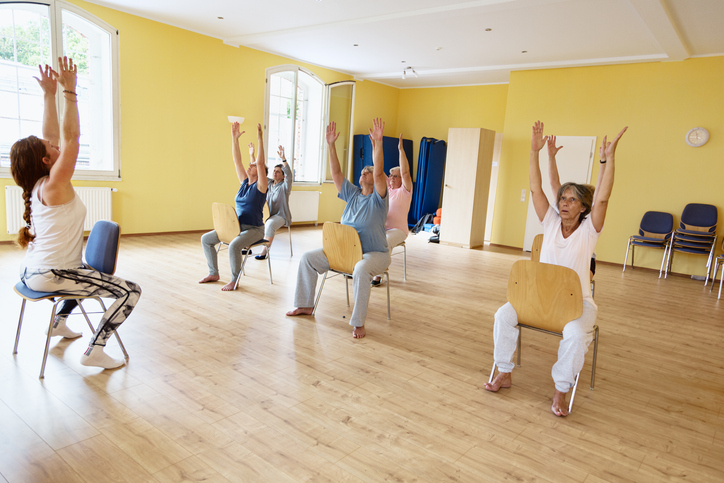
I want to click on windows, so click(313, 101), click(274, 101), click(90, 51), click(19, 56).